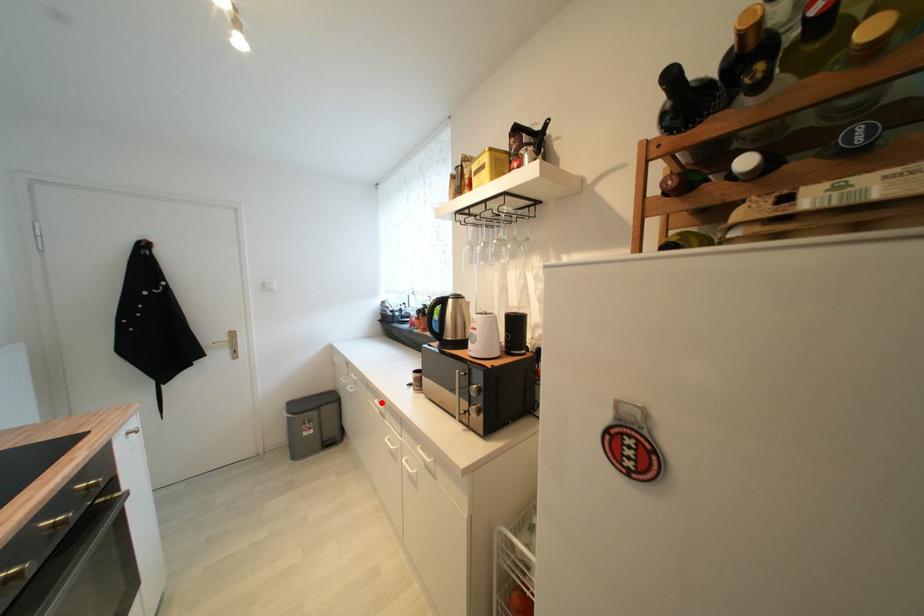
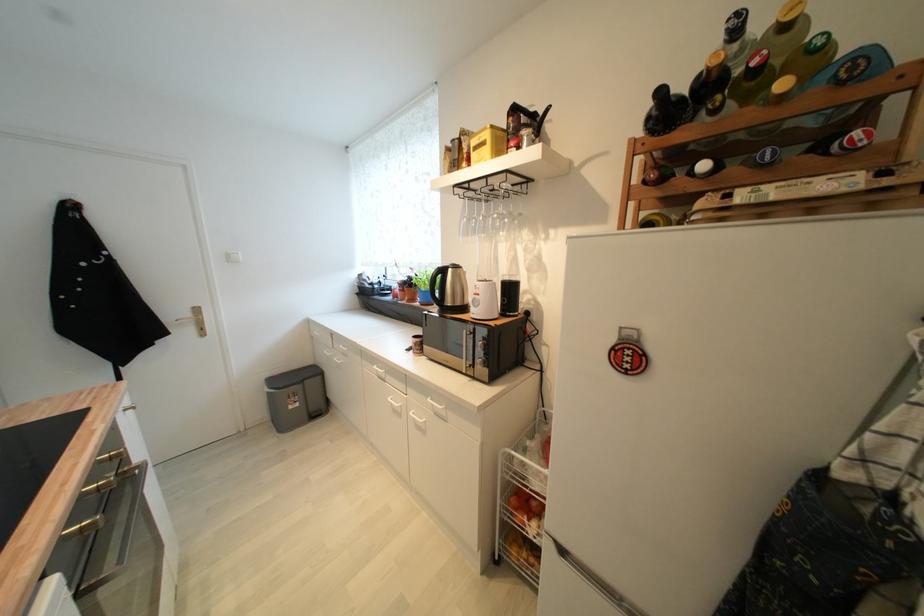
Locate, in the second image, the point that corresponds to the highlighted location in the first image.

(380, 369)